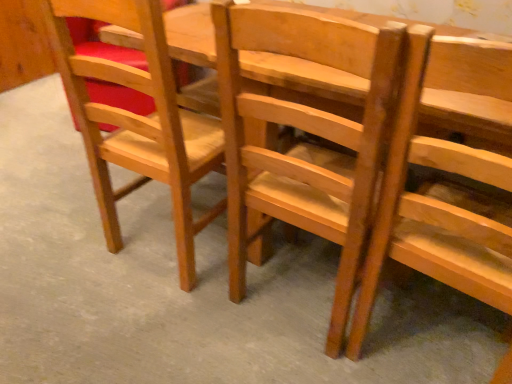
Question: Is matte wood chair at left, the first chair in the left-to-right sequence, far away from light brown wood chair at center, the 2th chair in the left-to-right sequence?

Choices:
 (A) yes
 (B) no

Answer: (B)

Question: Can you confirm if matte wood chair at left, which is the third chair in right-to-left order, is positioned to the left of light brown wood chair at center, the second chair from the right?

Choices:
 (A) yes
 (B) no

Answer: (A)

Question: Considering the relative sizes of matte wood chair at left, the first chair in the left-to-right sequence, and light brown wood chair at center, the second chair from the right, in the image provided, is matte wood chair at left, the first chair in the left-to-right sequence, wider than light brown wood chair at center, the second chair from the right,?

Choices:
 (A) no
 (B) yes

Answer: (A)

Question: Does matte wood chair at left, the first chair in the left-to-right sequence, have a lesser width compared to light brown wood chair at center, the 2th chair in the left-to-right sequence?

Choices:
 (A) no
 (B) yes

Answer: (B)

Question: Can we say matte wood chair at left, the first chair in the left-to-right sequence, lies outside light brown wood chair at center, the second chair from the right?

Choices:
 (A) no
 (B) yes

Answer: (B)

Question: From a real-world perspective, is matte wood chair at left, the first chair in the left-to-right sequence, on top of light brown wood chair at center, the 2th chair in the left-to-right sequence?

Choices:
 (A) yes
 (B) no

Answer: (B)

Question: Is light brown wood chair at center, the 2th chair in the left-to-right sequence, oriented away from wooden chair at center, the 1th chair in the right-to-left sequence?

Choices:
 (A) no
 (B) yes

Answer: (A)

Question: Would you consider light brown wood chair at center, the second chair from the right, to be distant from wooden chair at center, the 3th chair viewed from the left?

Choices:
 (A) yes
 (B) no

Answer: (B)

Question: Can you confirm if light brown wood chair at center, the second chair from the right, is wider than wooden chair at center, the 3th chair viewed from the left?

Choices:
 (A) no
 (B) yes

Answer: (B)

Question: Is light brown wood chair at center, the 2th chair in the left-to-right sequence, next to wooden chair at center, the 1th chair in the right-to-left sequence, and touching it?

Choices:
 (A) no
 (B) yes

Answer: (A)

Question: Is light brown wood chair at center, the second chair from the right, at the right side of wooden chair at center, the 1th chair in the right-to-left sequence?

Choices:
 (A) no
 (B) yes

Answer: (A)

Question: From a real-world perspective, is light brown wood chair at center, the 2th chair in the left-to-right sequence, over wooden chair at center, the 1th chair in the right-to-left sequence?

Choices:
 (A) yes
 (B) no

Answer: (B)

Question: Can you confirm if matte wood chair at left, the first chair in the left-to-right sequence, is positioned to the left of wooden chair at center, the 1th chair in the right-to-left sequence?

Choices:
 (A) yes
 (B) no

Answer: (A)